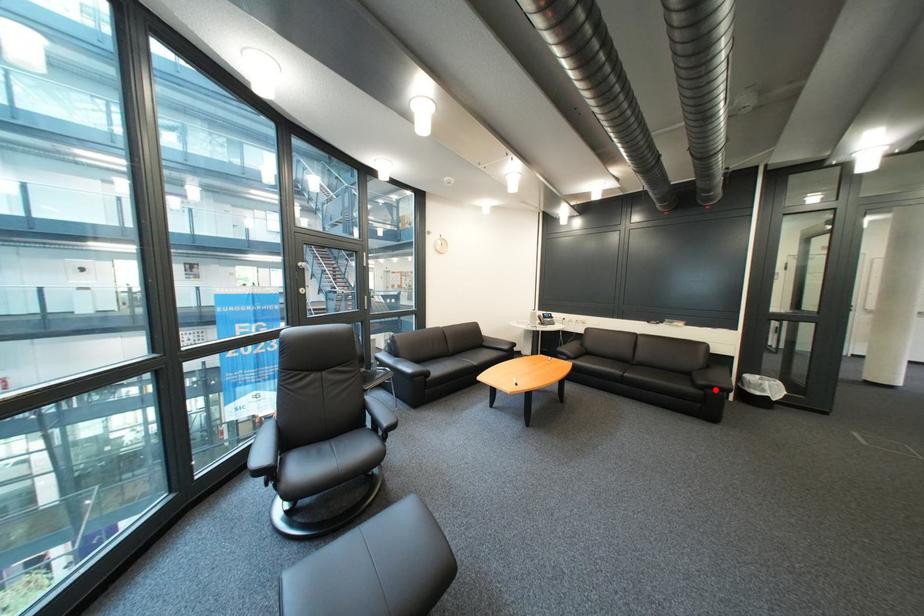
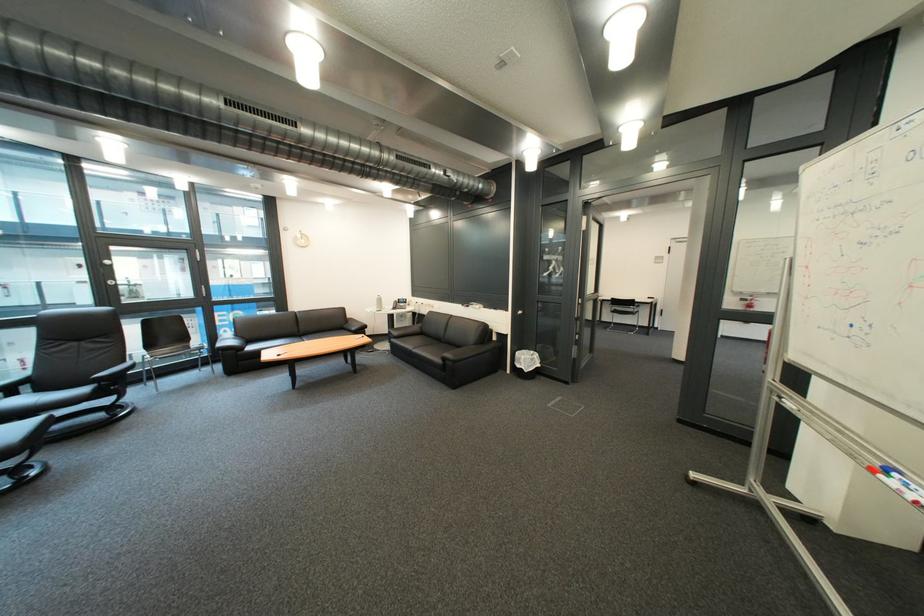
Locate, in the second image, the point that corresponds to the highlighted location in the first image.

(457, 361)